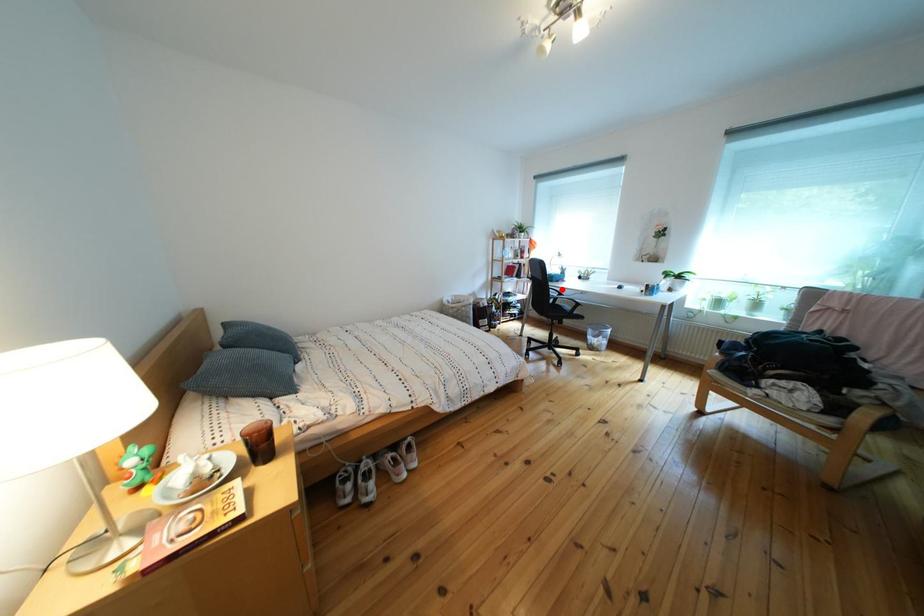
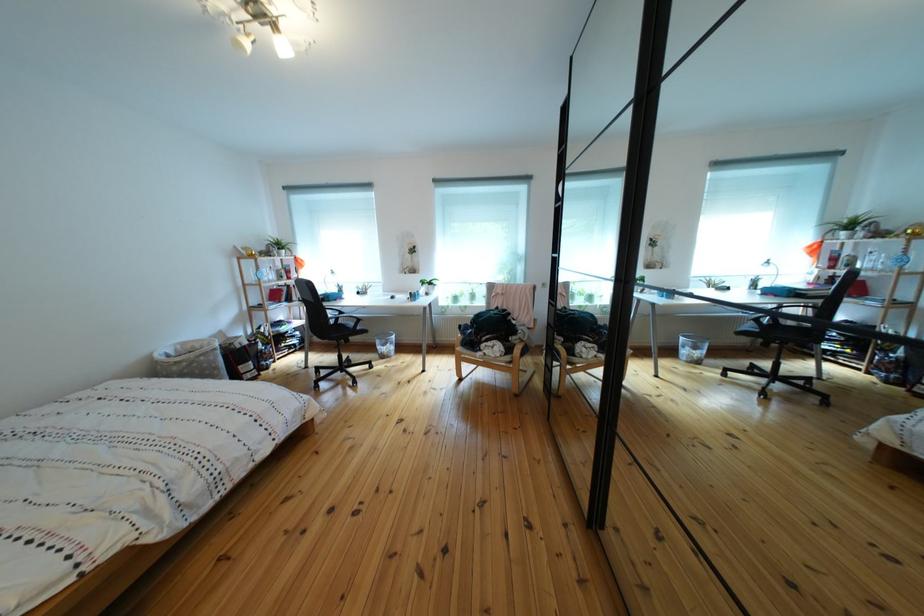
Question: A red point is marked in image1. In image2, is the corresponding 3D point closer to the camera or farther? Reply with the corresponding letter.

Choices:
 (A) The corresponding 3D point is closer.
 (B) The corresponding 3D point is farther.

Answer: (A)